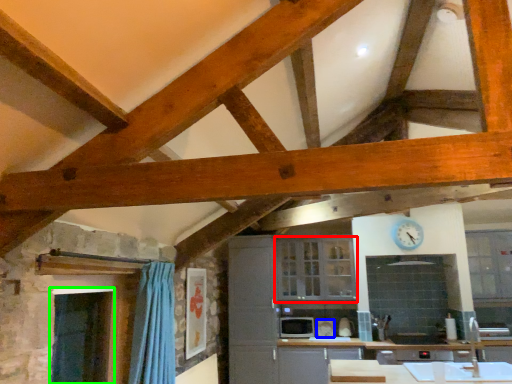
Question: Based on their relative distances, which object is nearer to cabinetry (highlighted by a red box)? Choose from appliance (highlighted by a blue box) and window screen (highlighted by a green box).

Choices:
 (A) appliance
 (B) window screen

Answer: (A)